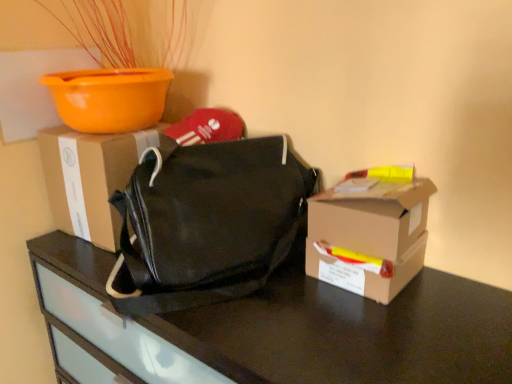
Where is `free point in front of black canvas bag at center`? The image size is (512, 384). free point in front of black canvas bag at center is located at coordinates (271, 327).